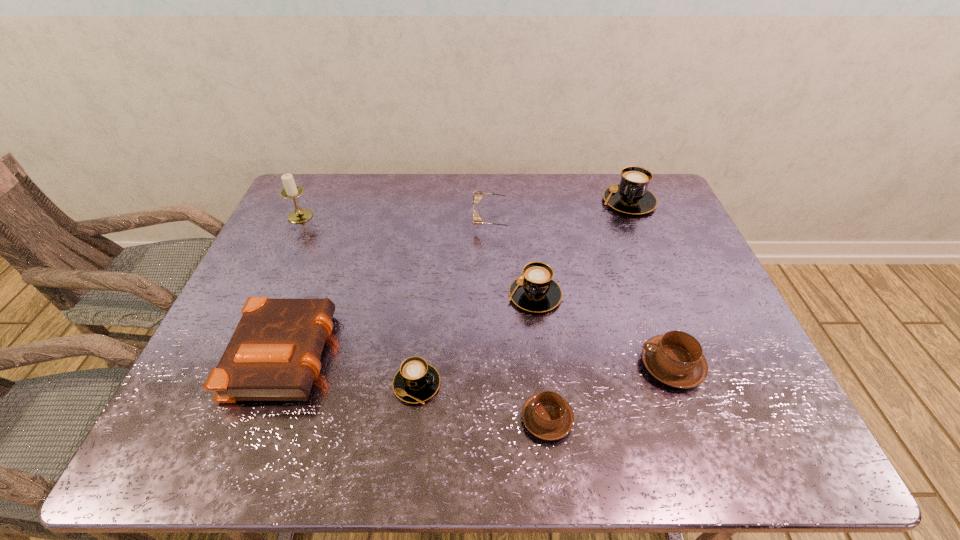
The height and width of the screenshot is (540, 960). What are the coordinates of `vacant space positioned 0.210m on the spine side of the Bible` in the screenshot? It's located at (420, 351).

What are the coordinates of `vacant space located on the side of the right brown cappuccino with the handle` in the screenshot? It's located at (566, 366).

Find the location of a particular element. Image resolution: width=960 pixels, height=540 pixels. vacant space located on the side of the right brown cappuccino with the handle is located at coordinates (566, 366).

Identify the location of free space located on the side of the right brown cappuccino with the handle. (566, 366).

This screenshot has height=540, width=960. What are the coordinates of `free space located on the right of the smallest black cappuccino` in the screenshot? It's located at (620, 384).

Where is `vacant space located on the side of the left brown cappuccino with the handle`? The width and height of the screenshot is (960, 540). vacant space located on the side of the left brown cappuccino with the handle is located at coordinates (534, 303).

The height and width of the screenshot is (540, 960). I want to click on vacant space located 0.090m on the side of the left brown cappuccino with the handle, so click(x=540, y=361).

Identify the location of vacant region located 0.070m on the side of the left brown cappuccino with the handle. This screenshot has height=540, width=960. (541, 368).

Where is `candle holder present at the far edge`? candle holder present at the far edge is located at coordinates (291, 190).

The width and height of the screenshot is (960, 540). In order to click on cappuccino that is at the far edge in this screenshot , I will do `click(631, 196)`.